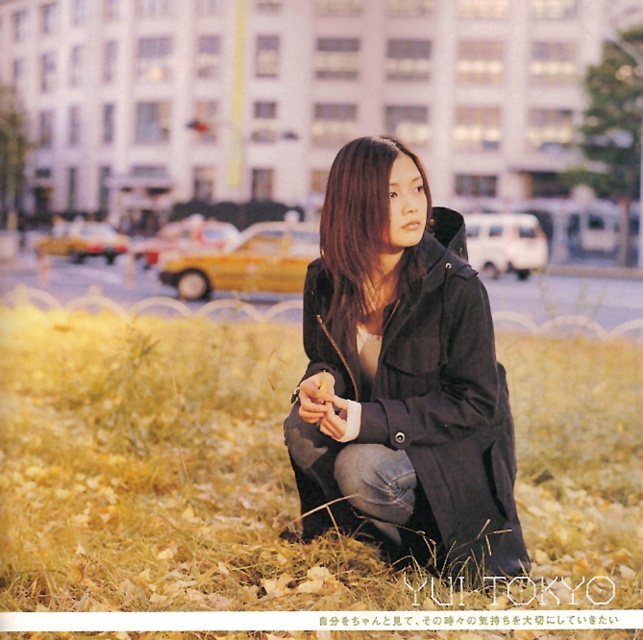
In the scene shown: You are a photographer trying to capture a detailed shot of the black matte jacket at center. However, the yellow dry grass at lower center is blocking your view. Can you adjust your position to avoid the grass?

The yellow dry grass at lower center is closer to the viewer than the black matte jacket at center, so moving your camera position slightly upwards or backwards might allow you to avoid the obstruction caused by the grass.

You are a photographer trying to capture a closeup of the yellow dry grass at lower center and the smooth black hair at center. Which object should you zoom in on first to ensure it fills the frame without moving the camera?

The yellow dry grass at lower center should be zoomed in on first because it is larger than the smooth black hair at center, so it will fill the frame more quickly when zooming in.

You are a photographer trying to capture a portrait of the person in the scene. The yellow dry grass at lower center and the smooth black hair at center are both in the frame. Which object is taller in the image?

The yellow dry grass at lower center is much taller than the smooth black hair at center, so the yellow dry grass at lower center is taller in the image.